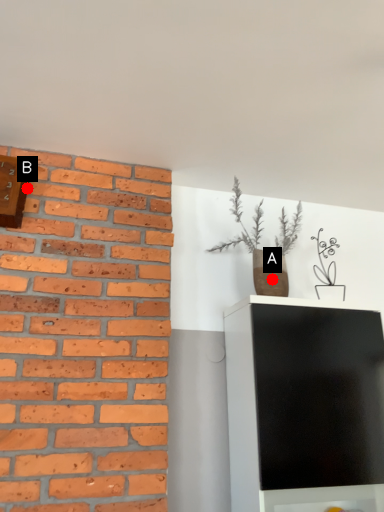
Question: Two points are circled on the image, labeled by A and B beside each circle. Which point is closer to the camera?

Choices:
 (A) A is closer
 (B) B is closer

Answer: (B)